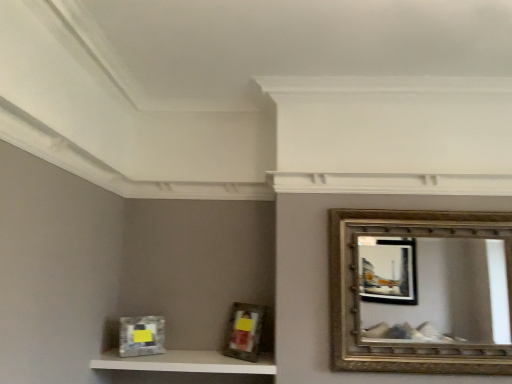
Question: Is gold textured mirror at upper right situated inside metallic silver picture frame at lower left, the second picture frame positioned from the right, or outside?

Choices:
 (A) inside
 (B) outside

Answer: (B)

Question: From their relative heights in the image, would you say gold textured mirror at upper right is taller or shorter than metallic silver picture frame at lower left, the second picture frame positioned from the right?

Choices:
 (A) short
 (B) tall

Answer: (B)

Question: Estimate the real-world distances between objects in this image. Which object is farther from the matte silver picture frame at center, placed as the second picture frame when sorted from left to right?

Choices:
 (A) metallic silver picture frame at lower left, the second picture frame positioned from the right
 (B) gold textured mirror at upper right
 (C) white textured shelf at lower left

Answer: (B)

Question: Considering the real-world distances, which object is closest to the gold textured mirror at upper right?

Choices:
 (A) metallic silver picture frame at lower left, the second picture frame positioned from the right
 (B) matte silver picture frame at center, placed as the second picture frame when sorted from left to right
 (C) white textured shelf at lower left

Answer: (B)